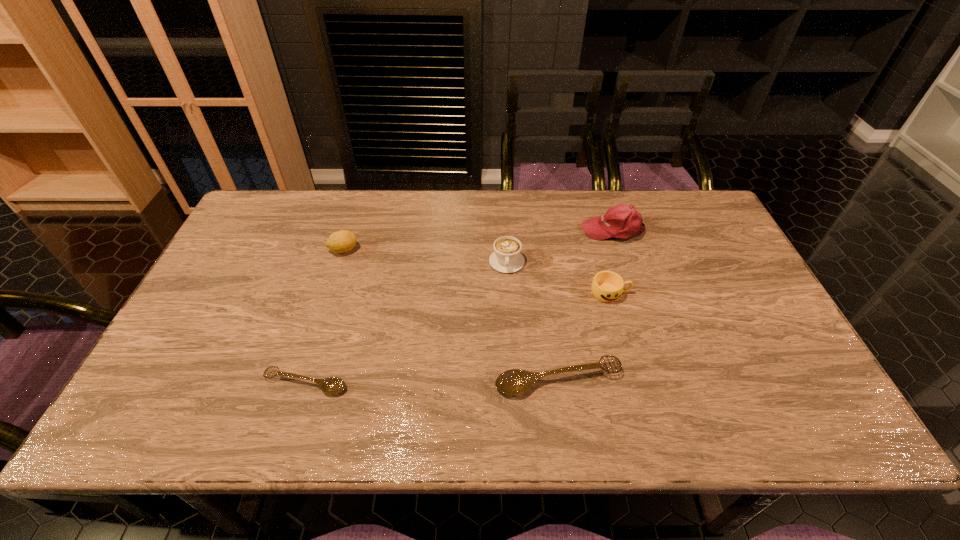
Where is `the left ladle`? Image resolution: width=960 pixels, height=540 pixels. the left ladle is located at coordinates [333, 385].

At what (x,y) coordinates should I click in order to perform the action: click on the shortest object. Please return your answer as a coordinate pair (x, y). This screenshot has height=540, width=960. Looking at the image, I should click on (333, 385).

Find the location of `the right ladle`. the right ladle is located at coordinates (515, 382).

Locate an element on the screen. The height and width of the screenshot is (540, 960). the taller ladle is located at coordinates (515, 382).

What are the coordinates of `lemon` in the screenshot? It's located at (342, 241).

Locate an element on the screen. This screenshot has height=540, width=960. the tallest object is located at coordinates (622, 221).

You are a GUI agent. You are given a task and a screenshot of the screen. Output one action in this format:
    pyautogui.click(x=<x>, y=<y>)
    Task: Click on the cappuccino
    
    Given the screenshot: What is the action you would take?
    pyautogui.click(x=506, y=258)

The height and width of the screenshot is (540, 960). I want to click on the fourth tallest object, so click(607, 286).

This screenshot has height=540, width=960. Identify the location of the third nearest object. (607, 286).

Identify the location of vacant area situated 0.350m on the right of the left ladle. This screenshot has width=960, height=540. (500, 383).